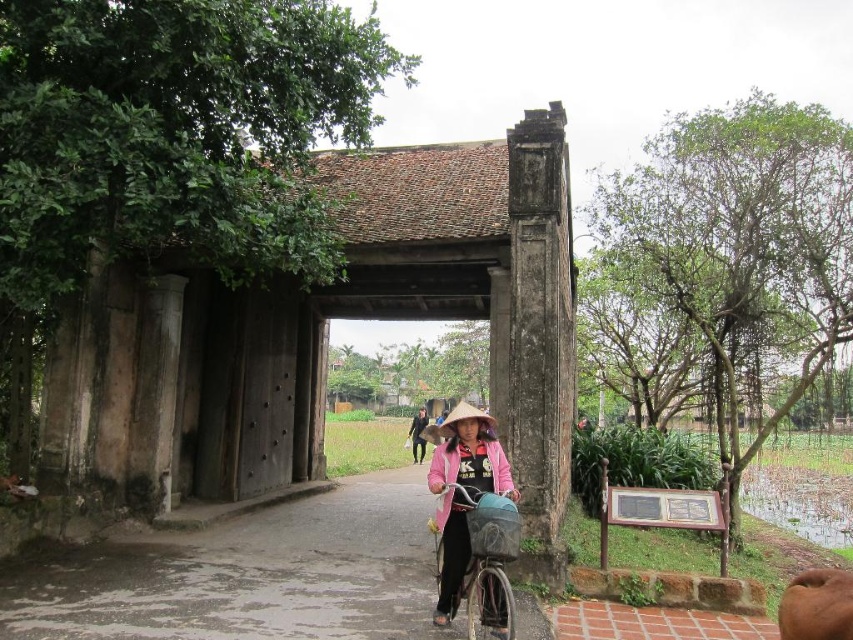
Question: Which point is closer to the camera?

Choices:
 (A) black matte jacket at center
 (B) brown straw hat at center
 (C) metallic silver bicycle at center

Answer: (C)

Question: Can you confirm if brown straw hat at center is wider than black matte jacket at center?

Choices:
 (A) yes
 (B) no

Answer: (A)

Question: Which point is closer to the camera taking this photo?

Choices:
 (A) (476, 410)
 (B) (425, 416)

Answer: (A)

Question: Which point is farther to the camera?

Choices:
 (A) black matte jacket at center
 (B) brown straw hat at center
 (C) metallic silver bicycle at center

Answer: (A)

Question: Does metallic silver bicycle at center lie in front of black matte jacket at center?

Choices:
 (A) yes
 (B) no

Answer: (A)

Question: In this image, where is brown straw hat at center located relative to black matte jacket at center?

Choices:
 (A) above
 (B) below

Answer: (A)